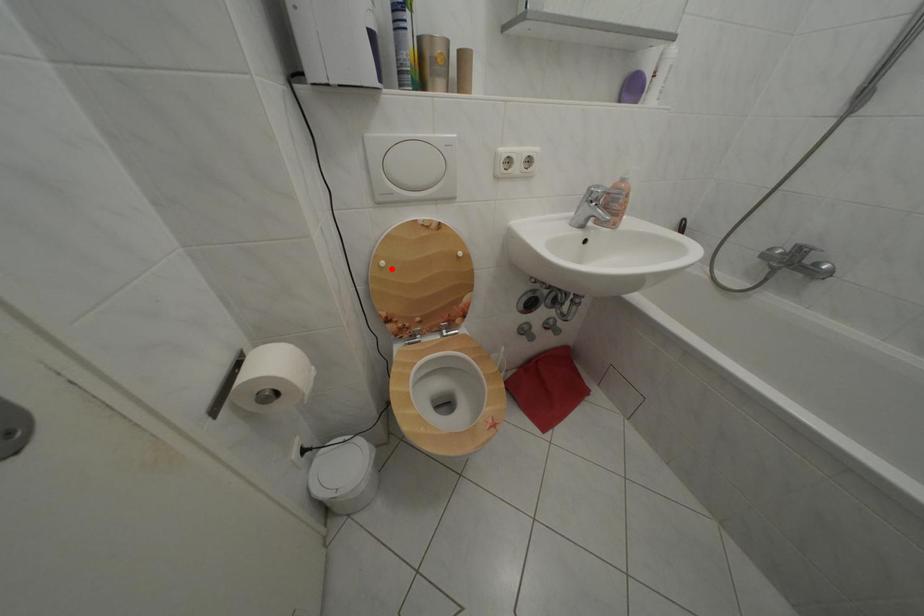
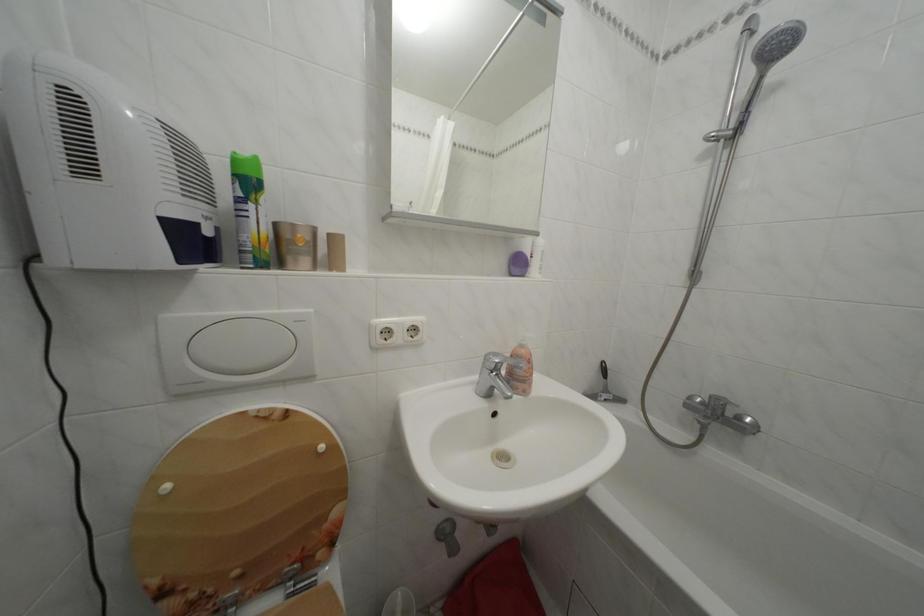
Find the pixel in the second image that matches the highlighted location in the first image.

(176, 493)